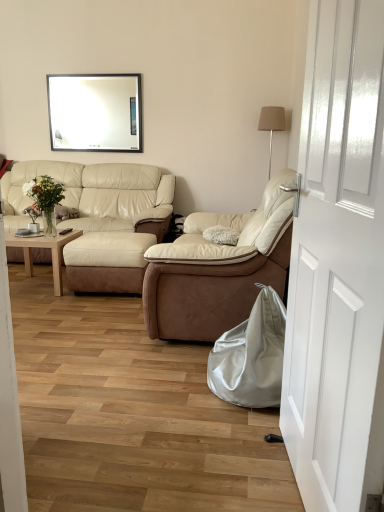
Question: From the image's perspective, relative to satin silver bean bag at lower right, is white glossy mirror at upper center above or below?

Choices:
 (A) below
 (B) above

Answer: (B)

Question: Is white glossy mirror at upper center in front of or behind satin silver bean bag at lower right in the image?

Choices:
 (A) behind
 (B) front

Answer: (A)

Question: Estimate the real-world distances between objects in this image. Which object is farther from the beige leather couch at center, acting as the first studio couch starting from the back?

Choices:
 (A) beige leather recliner at center, arranged as the 2th studio couch when viewed from the back
 (B) white glossy door at center
 (C) white glossy mirror at upper center
 (D) light wood/finished coffee table at left
 (E) beige fabric lampshade at upper right

Answer: (B)

Question: Which is nearer to the beige suede footrest at center?

Choices:
 (A) white glossy mirror at upper center
 (B) satin silver bean bag at lower right
 (C) white glossy door at center
 (D) beige leather couch at center, the 1th studio couch from the left
 (E) beige leather recliner at center, the 1th studio couch from the front

Answer: (D)